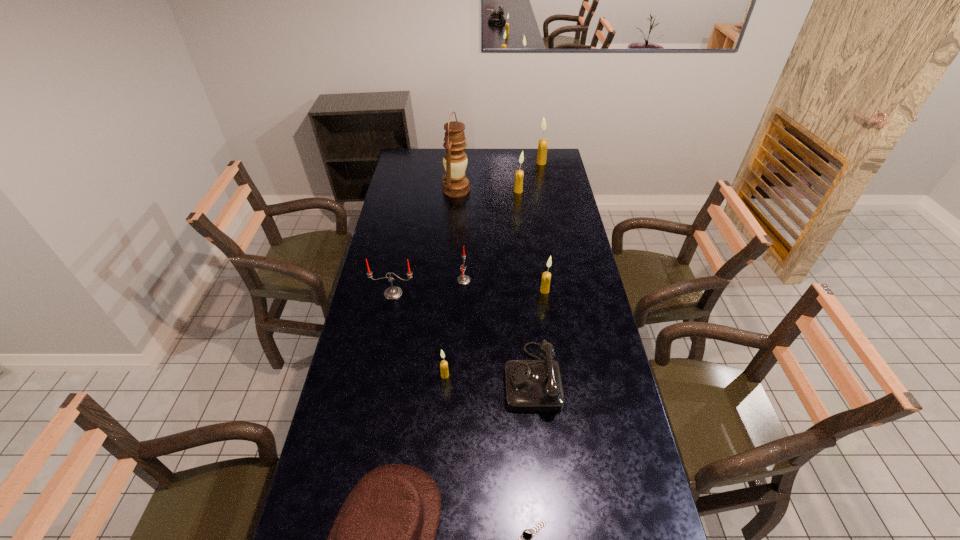
Identify which object is the ninth closest to the watch. Please provide its 2D coordinates. Your answer should be formatted as a tuple, i.e. [(x, y)], where the tuple contains the x and y coordinates of a point satisfying the conditions above.

[(543, 143)]

At what (x,y) coordinates should I click in order to perform the action: click on candle that is the fifth closest to the watch. Please return your answer as a coordinate pair (x, y). This screenshot has width=960, height=540. Looking at the image, I should click on (518, 186).

The width and height of the screenshot is (960, 540). I want to click on candle that can be found as the second closest to the fifth shortest candle, so (x=463, y=279).

You are a GUI agent. You are given a task and a screenshot of the screen. Output one action in this format:
    pyautogui.click(x=<x>, y=<y>)
    Task: Click on the cream candle that is the second closest to the nearest cream candle
    
    Given the screenshot: What is the action you would take?
    pyautogui.click(x=518, y=186)

Where is `cream candle that can be found as the third closest to the second smallest cream candle`? This screenshot has height=540, width=960. cream candle that can be found as the third closest to the second smallest cream candle is located at coordinates (543, 143).

Image resolution: width=960 pixels, height=540 pixels. Identify the location of free space that satisfies the following two spatial constraints: 1. on the front-facing side of the smaller red candle; 2. on the front-facing side of the leftmost candle. (464, 293).

This screenshot has width=960, height=540. I want to click on blank space that satisfies the following two spatial constraints: 1. on the back side of the nearest candle; 2. on the left side of the second candle from right to left, so click(450, 291).

You are a GUI agent. You are given a task and a screenshot of the screen. Output one action in this format:
    pyautogui.click(x=<x>, y=<y>)
    Task: Click on the free space that satisfies the following two spatial constraints: 1. on the front side of the second biggest cream candle; 2. on the front-facing side of the smaller red candle
    This screenshot has height=540, width=960.
    Given the screenshot: What is the action you would take?
    pyautogui.click(x=528, y=280)